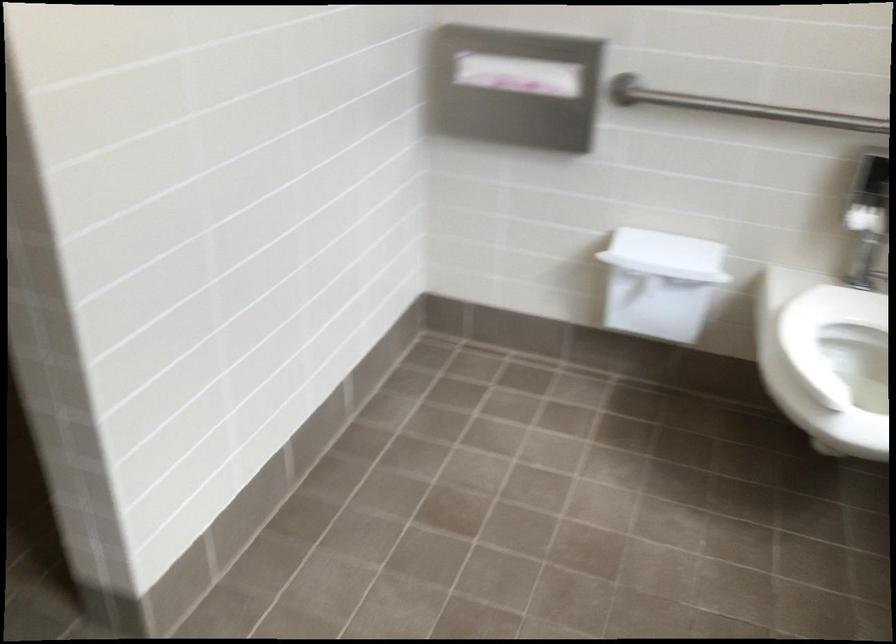
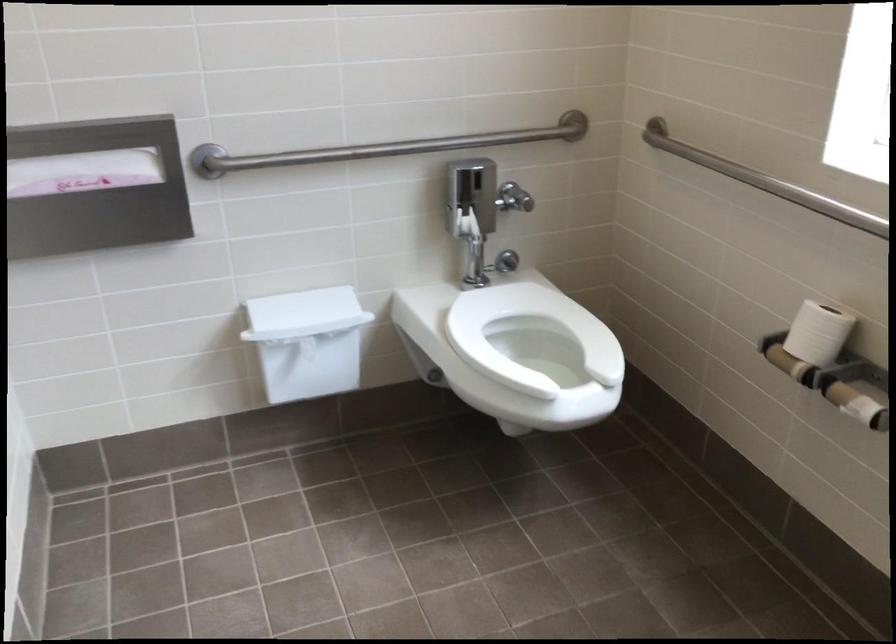
In the second image, find the point that corresponds to pixel 661 252 in the first image.

(304, 314)